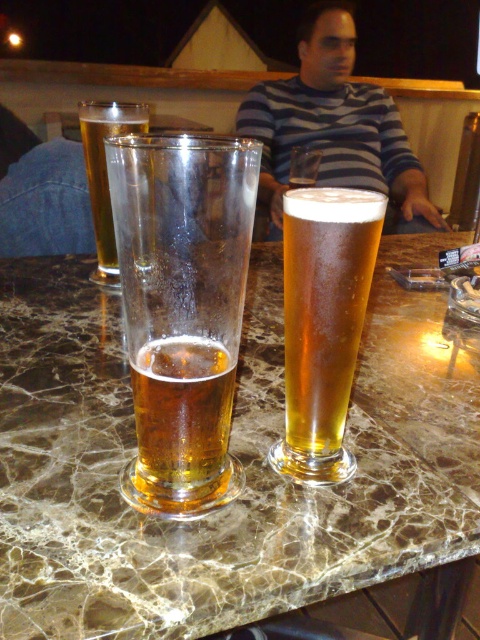
Measure the distance from striped shirt at center to clear glass beer at center.

A distance of 1.72 meters exists between striped shirt at center and clear glass beer at center.

Can you confirm if striped shirt at center is wider than clear glass beer at center?

Yes.

Locate an element on the screen. striped shirt at center is located at coordinates (333, 124).

Does translucent glass beer at center have a lesser width compared to clear glass beer at center?

→ Yes, translucent glass beer at center is thinner than clear glass beer at center.

Where is `translucent glass beer at center`? The width and height of the screenshot is (480, 640). translucent glass beer at center is located at coordinates (182, 419).

What are the coordinates of `translucent glass beer at center` in the screenshot? It's located at (182, 419).

Between marble table at center and translucent glass beer at left, which one has less height?

With less height is translucent glass beer at left.

Does marble table at center have a lesser width compared to translucent glass beer at left?

No, marble table at center is not thinner than translucent glass beer at left.

Does point (391, 444) come closer to viewer compared to point (177, 234)?

No, (391, 444) is further to viewer.

I want to click on marble table at center, so click(x=232, y=452).